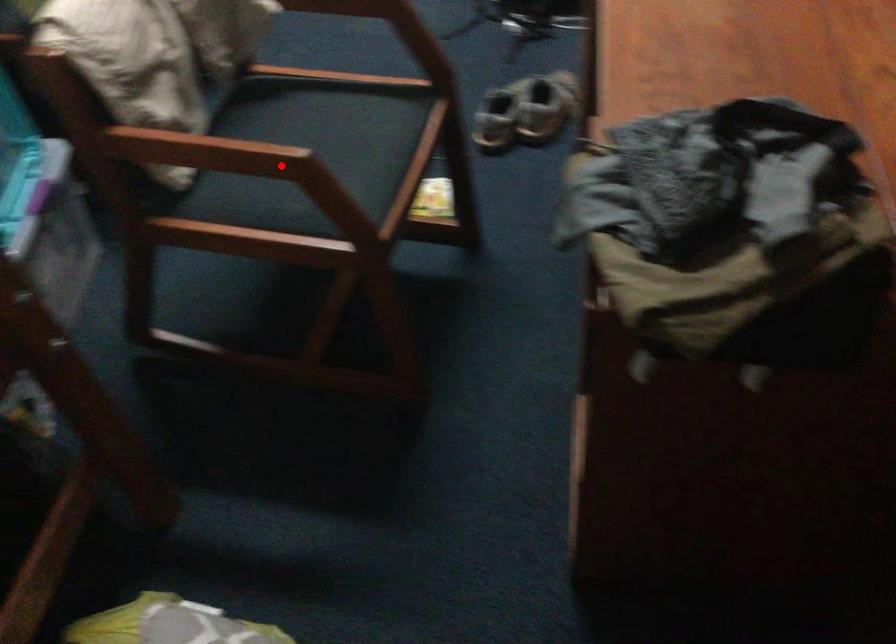
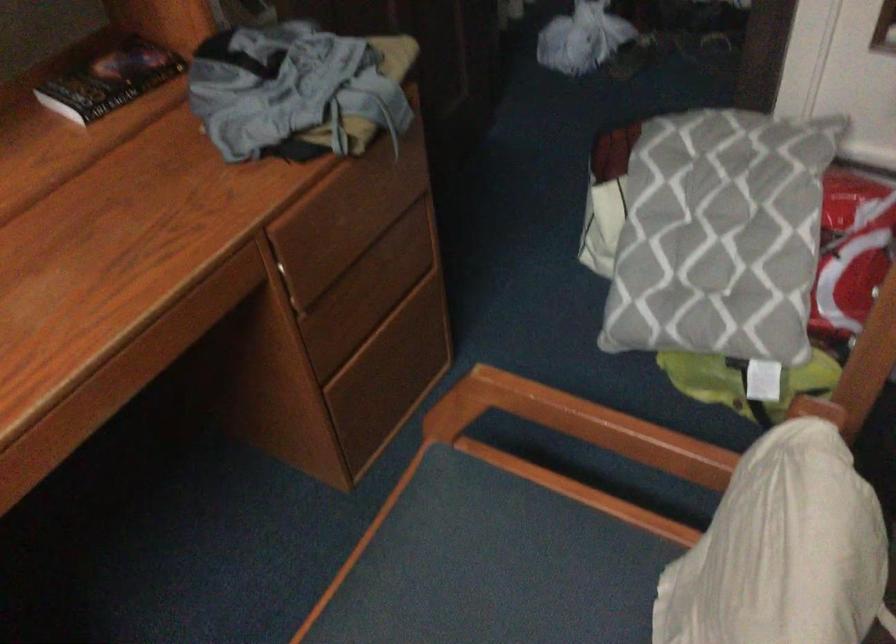
Locate, in the second image, the point that corresponds to the highlighted location in the first image.

(579, 424)